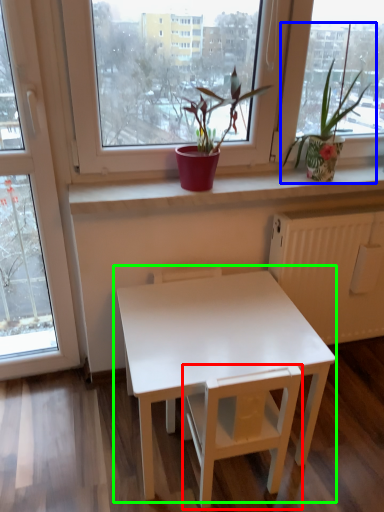
Question: Which is nearer to the armchair (highlighted by a red box)? houseplant (highlighted by a blue box) or table (highlighted by a green box).

Choices:
 (A) houseplant
 (B) table

Answer: (B)